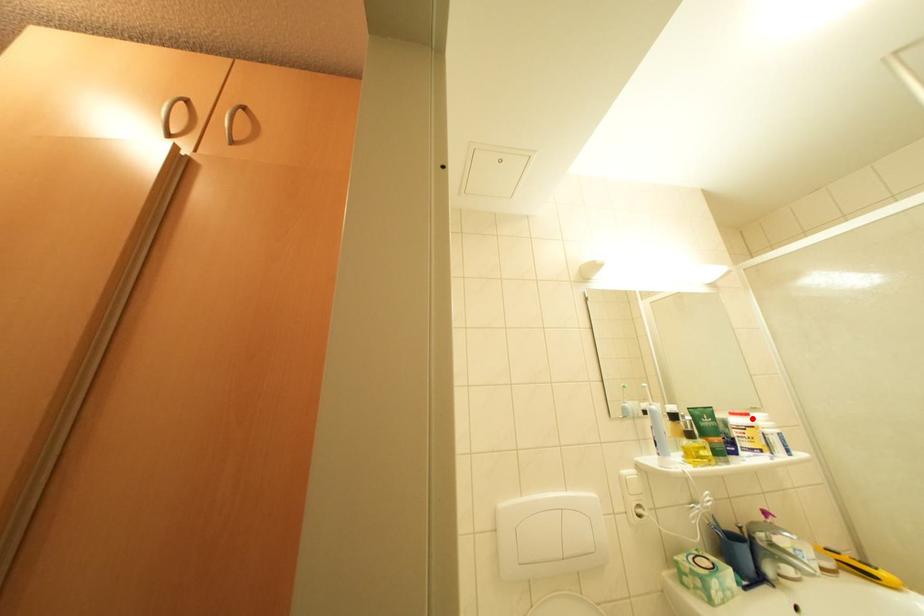
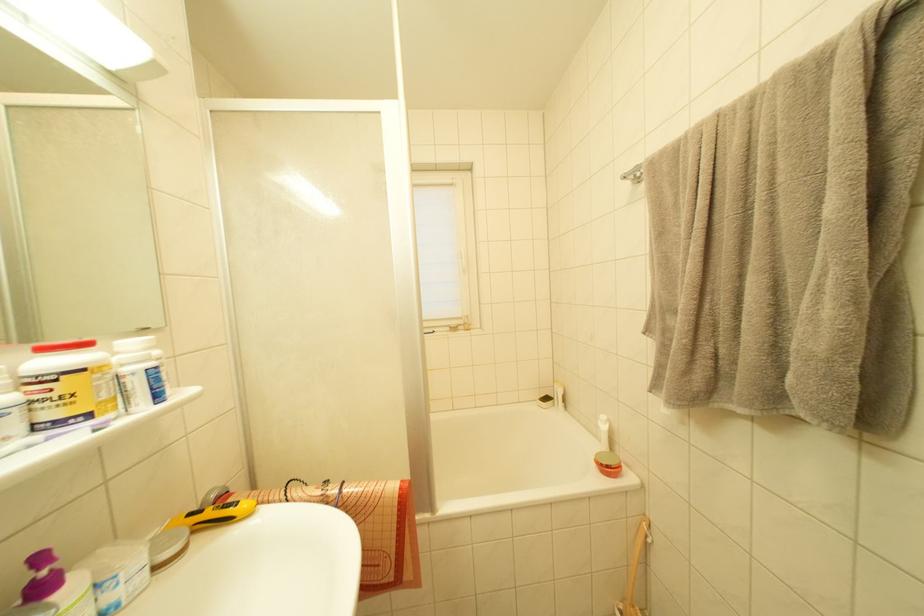
Locate, in the second image, the point that corresponds to the highlighted location in the first image.

(91, 349)